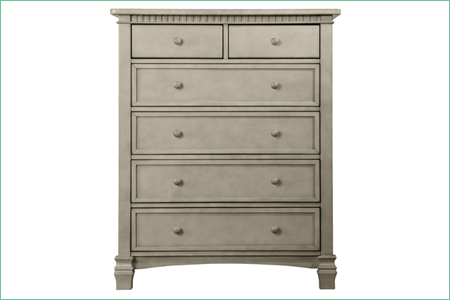
I want to click on drawers with one knob, so click(x=198, y=36), click(x=289, y=39).